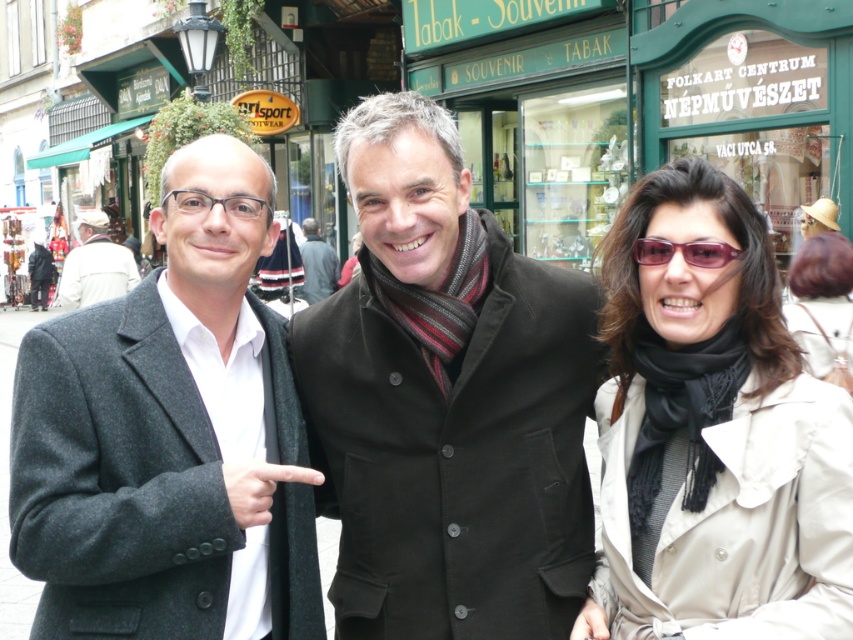
What is located at the coordinates point (x=259, y=486)?

The dark gray woolen hand at center is located at point (x=259, y=486).

What is the 2D coordinate of the dark gray woolen hand at center?

The dark gray woolen hand at center is located at the 2D coordinate point of (259, 486).